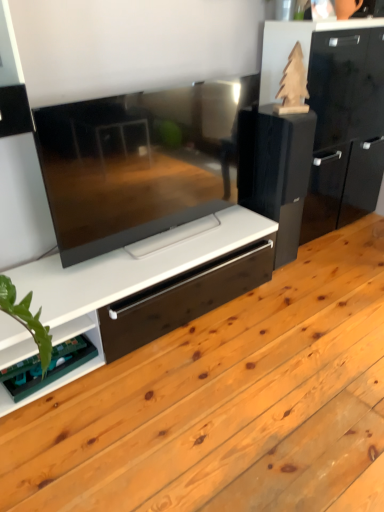
Question: Considering the positions of green circuit board at lower left and black glossy speaker at upper right in the image, is green circuit board at lower left taller or shorter than black glossy speaker at upper right?

Choices:
 (A) short
 (B) tall

Answer: (A)

Question: Based on their sizes in the image, would you say green circuit board at lower left is bigger or smaller than black glossy speaker at upper right?

Choices:
 (A) small
 (B) big

Answer: (A)

Question: Do you think green circuit board at lower left is within black glossy speaker at upper right, or outside of it?

Choices:
 (A) inside
 (B) outside

Answer: (B)

Question: Is point (248, 140) closer or farther from the camera than point (1, 389)?

Choices:
 (A) farther
 (B) closer

Answer: (A)

Question: In terms of size, does black glossy speaker at upper right appear bigger or smaller than green circuit board at lower left?

Choices:
 (A) big
 (B) small

Answer: (A)

Question: From a real-world perspective, relative to green circuit board at lower left, is black glossy speaker at upper right vertically above or below?

Choices:
 (A) below
 (B) above

Answer: (B)

Question: From the image's perspective, is black glossy speaker at upper right located above or below green circuit board at lower left?

Choices:
 (A) above
 (B) below

Answer: (A)